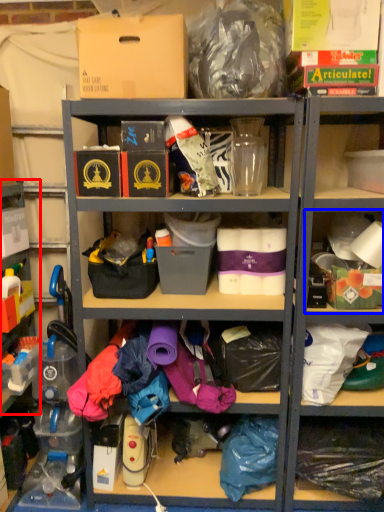
Question: Among these objects, which one is nearest to the camera, shelf (highlighted by a red box) or shelf (highlighted by a blue box)?

Choices:
 (A) shelf
 (B) shelf

Answer: (A)